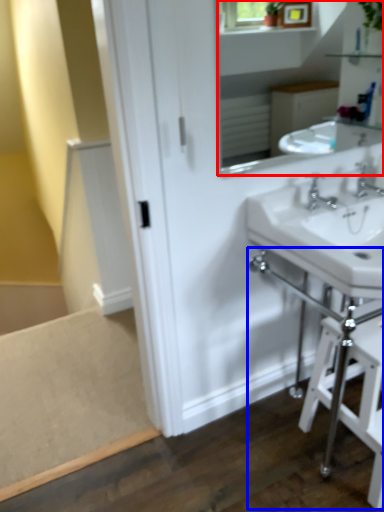
Question: Which object appears closest to the camera in this image, mirror (highlighted by a red box) or table (highlighted by a blue box)?

Choices:
 (A) mirror
 (B) table

Answer: (A)